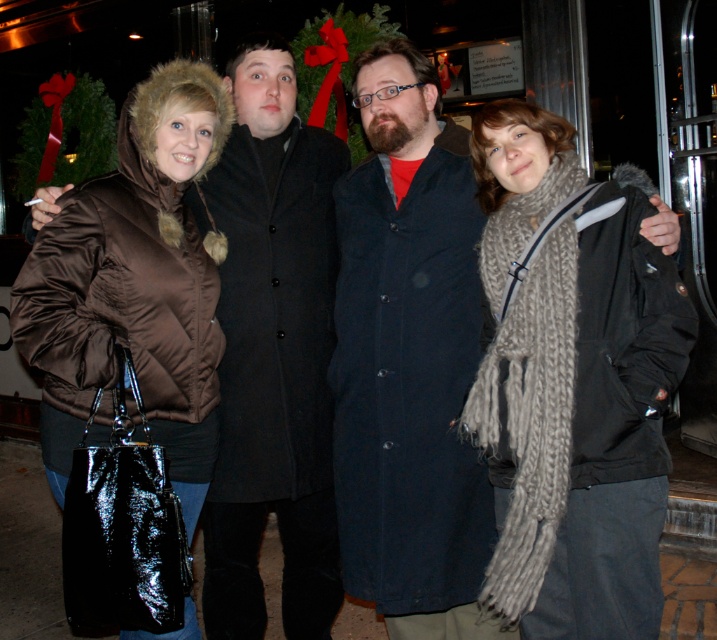
Question: Which object is farther from the camera taking this photo?

Choices:
 (A) knitted gray scarf at center
 (B) dark blue wool coat at center

Answer: (B)

Question: Can you confirm if dark blue wool coat at center is positioned below brown shiny coat at left?

Choices:
 (A) no
 (B) yes

Answer: (B)

Question: Does knitted gray scarf at center have a greater width compared to brown shiny coat at left?

Choices:
 (A) yes
 (B) no

Answer: (A)

Question: Does dark blue wool coat at center have a greater width compared to brown shiny coat at left?

Choices:
 (A) no
 (B) yes

Answer: (B)

Question: Which object appears closest to the camera in this image?

Choices:
 (A) brown shiny coat at left
 (B) knitted gray scarf at center
 (C) dark blue wool coat at center

Answer: (B)

Question: Estimate the real-world distances between objects in this image. Which object is farther from the knitted gray scarf at center?

Choices:
 (A) brown shiny coat at left
 (B) dark blue wool coat at center

Answer: (A)